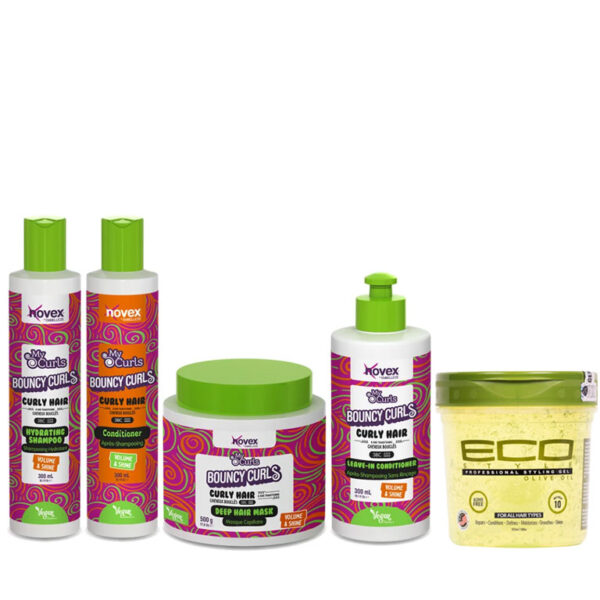
Locate an element on the screen. lids for jars/bottles is located at coordinates (515, 388), (386, 313), (249, 385), (123, 243), (49, 244).